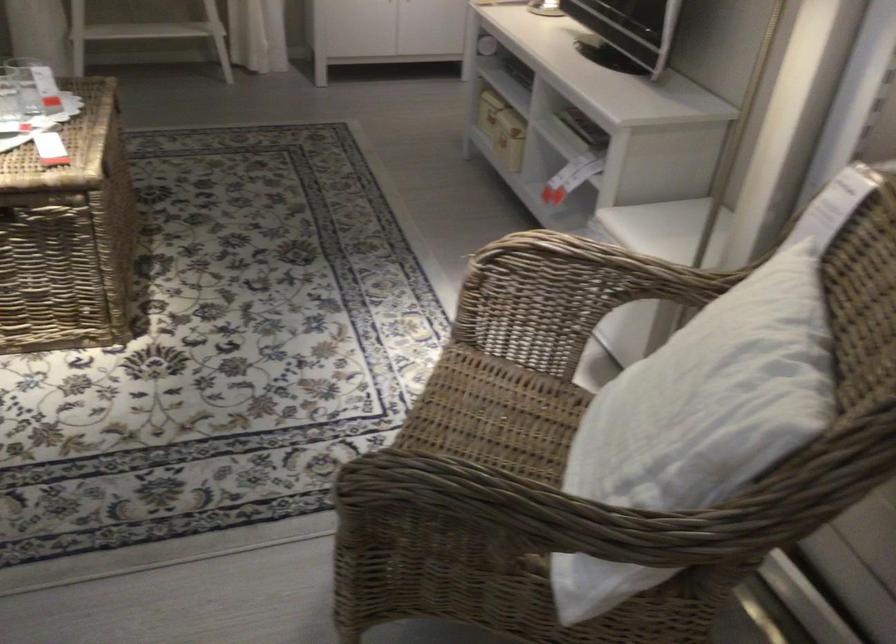
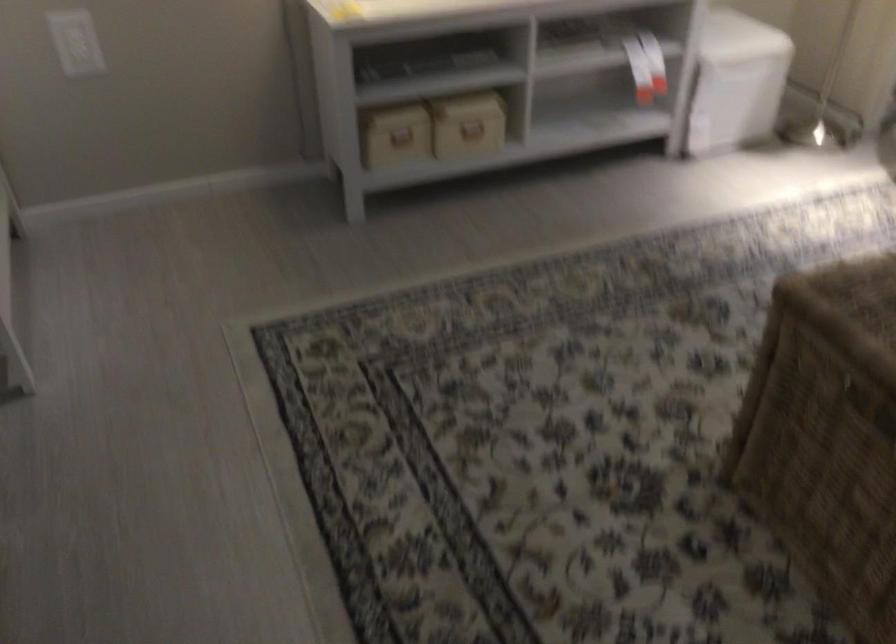
Find the pixel in the second image that matches point 492,113 in the first image.

(401, 136)